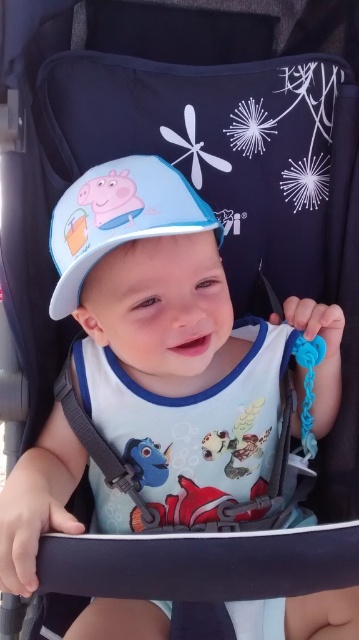
Question: Can you confirm if white matte bib at center is thinner than matte blue fabric hat at center?

Choices:
 (A) no
 (B) yes

Answer: (A)

Question: Which object appears closest to the camera in this image?

Choices:
 (A) matte blue fabric hat at center
 (B) white matte bib at center

Answer: (A)

Question: Which object is closer to the camera taking this photo?

Choices:
 (A) matte blue fabric hat at center
 (B) white matte bib at center

Answer: (A)

Question: Does white matte bib at center appear under matte blue fabric hat at center?

Choices:
 (A) no
 (B) yes

Answer: (B)

Question: Can you confirm if white matte bib at center is thinner than matte blue fabric hat at center?

Choices:
 (A) no
 (B) yes

Answer: (A)

Question: Which of the following is the closest to the observer?

Choices:
 (A) matte blue fabric hat at center
 (B) white matte bib at center

Answer: (A)